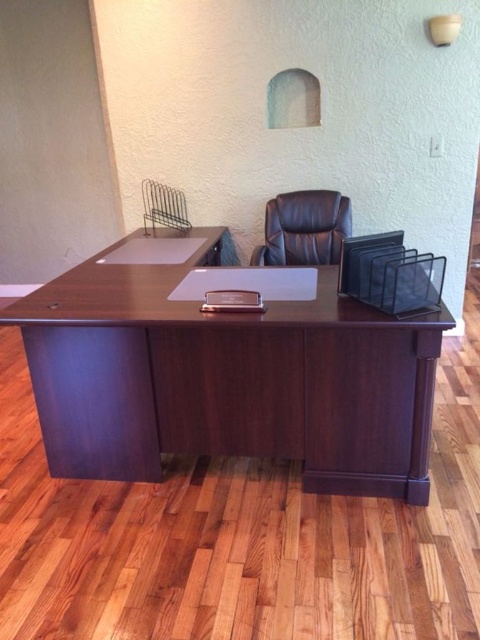
Can you confirm if dark wood computer desk at center is positioned below leather at center?

Yes.

Is dark wood computer desk at center thinner than leather at center?

No.

Between point (340, 419) and point (278, 216), which one is positioned in front?

Point (340, 419) is in front.

Where is `dark wood computer desk at center`? The width and height of the screenshot is (480, 640). dark wood computer desk at center is located at coordinates (228, 380).

Is point (268, 248) in front of point (431, 17)?

That is False.

Between point (307, 257) and point (451, 36), which one is positioned behind?

The point (307, 257) is behind.

Who is more forward, (x=256, y=257) or (x=451, y=28)?

Point (x=451, y=28)

Identify the location of leather at center. (303, 228).

Who is higher up, dark wood computer desk at center or white matte lampshade at upper center?

white matte lampshade at upper center

Looking at this image, which of these two, dark wood computer desk at center or white matte lampshade at upper center, stands shorter?

white matte lampshade at upper center

The width and height of the screenshot is (480, 640). Describe the element at coordinates (228, 380) in the screenshot. I see `dark wood computer desk at center` at that location.

You are a GUI agent. You are given a task and a screenshot of the screen. Output one action in this format:
    pyautogui.click(x=<x>, y=<y>)
    Task: Click on the dark wood computer desk at center
    
    Given the screenshot: What is the action you would take?
    pyautogui.click(x=228, y=380)